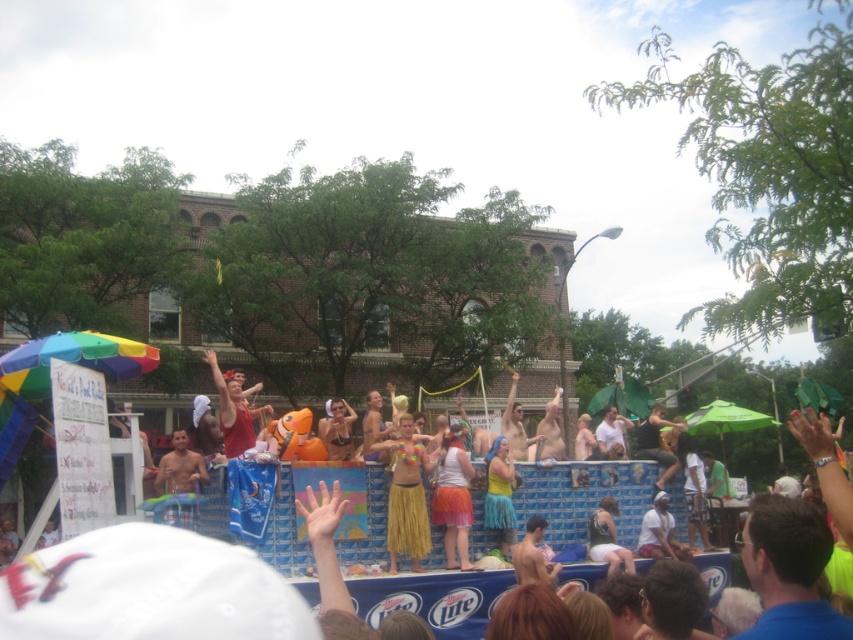
Based on the photo, you are a photographer at the parade and want to capture both the yellow grass skirt at center and the red fabric shirt at center in a single photo. Which object should you focus on first to ensure both are in the frame?

You should focus on the yellow grass skirt at center first since it is closer to the viewer than the red fabric shirt at center, ensuring both are in the frame.

You are at the parade and want to take a photo of the float. You notice the yellow grass skirt at center and the red fabric shirt at center. Which one should you focus on if you want to capture the lower part of the float?

The yellow grass skirt at center is below the red fabric shirt at center, so you should focus on the yellow grass skirt at center to capture the lower part of the float.

You are standing in the crowd at the parade. You see the yellow grass skirt at center. Where exactly is it located in the image?

The yellow grass skirt at center is located at point (407, 496) in the image.